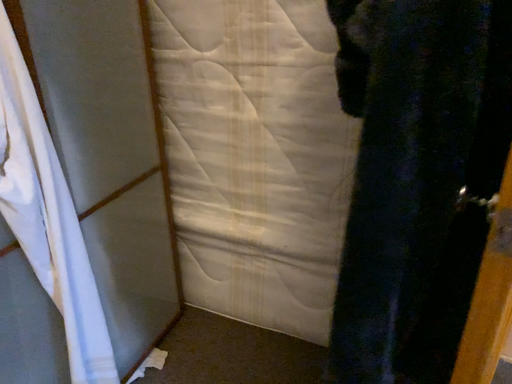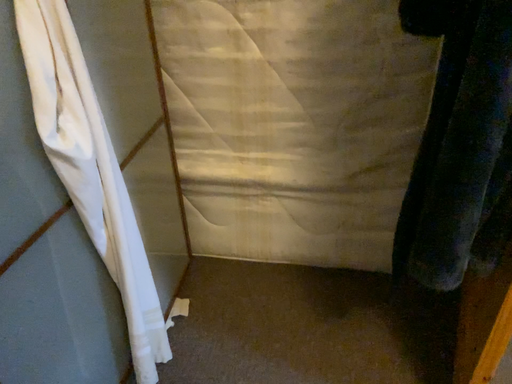
Question: Which way did the camera rotate in the video?

Choices:
 (A) rotated left
 (B) rotated right

Answer: (B)